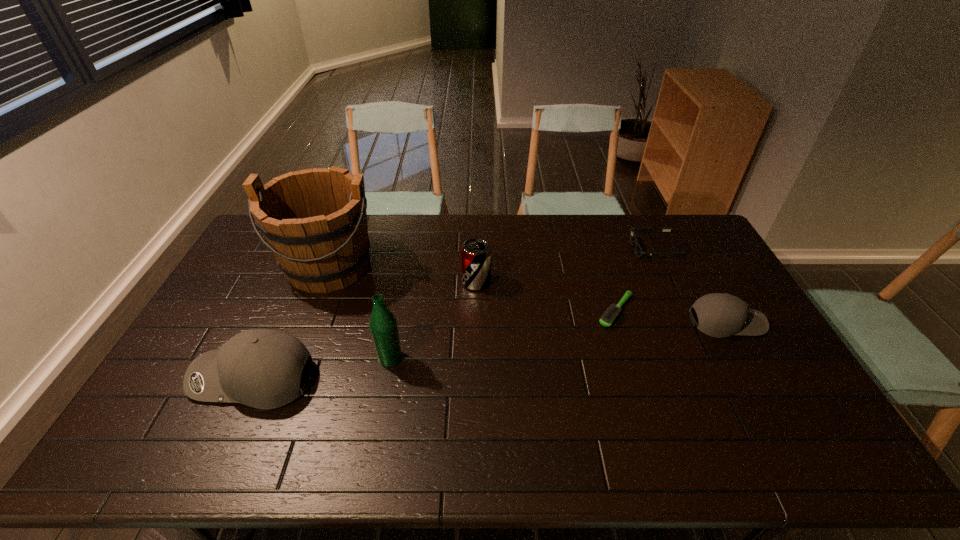
Where is `vacant point located between the taller baseball cap and the wine bucket`? vacant point located between the taller baseball cap and the wine bucket is located at coordinates (292, 322).

Where is `empty location between the tallest object and the left baseball cap`? empty location between the tallest object and the left baseball cap is located at coordinates (292, 322).

Identify which object is the sixth nearest to the sixth shortest object. Please provide its 2D coordinates. Your answer should be formatted as a tuple, i.e. [(x, y)], where the tuple contains the x and y coordinates of a point satisfying the conditions above.

[(720, 315)]

The image size is (960, 540). In order to click on object that is the second nearest to the farther baseball cap in this screenshot , I will do `click(638, 250)`.

I want to click on vacant area that satisfies the following two spatial constraints: 1. on the temples of the second shortest object; 2. on the front side of the shortest object, so click(x=684, y=311).

The image size is (960, 540). I want to click on vacant space that satisfies the following two spatial constraints: 1. on the front side of the fifth object from left to right; 2. on the front brim of the taller baseball cap, so click(x=637, y=379).